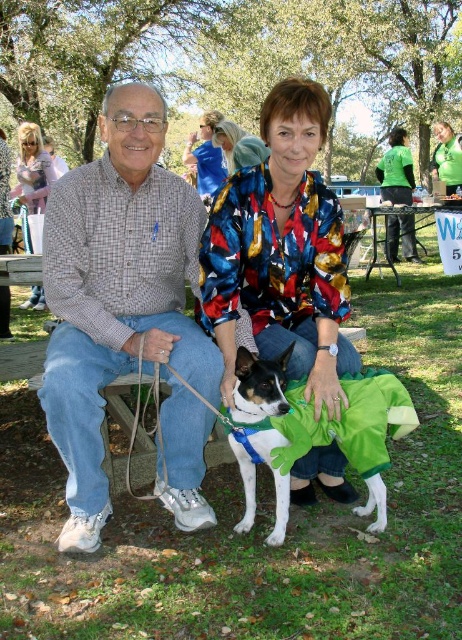
You are standing in the park and want to take a photo of the scene. The camera you have can focus on objects within 5 feet. Is the point at coordinates point (286, 516) within the camera focus range?

The distance of point (286, 516) from the camera is 7.42 feet, which is beyond the camera focus range of 5 feet. Therefore, the point is out of focus.

You are planning to take a photo of the blonde hair at upper left and the black metal picnic table at center in the park. Which object should you focus on first if you want to capture both in one shot without moving the camera?

You should focus on the black metal picnic table at center first because it is larger than the blonde hair at upper left, allowing you to frame the shot to include both objects.